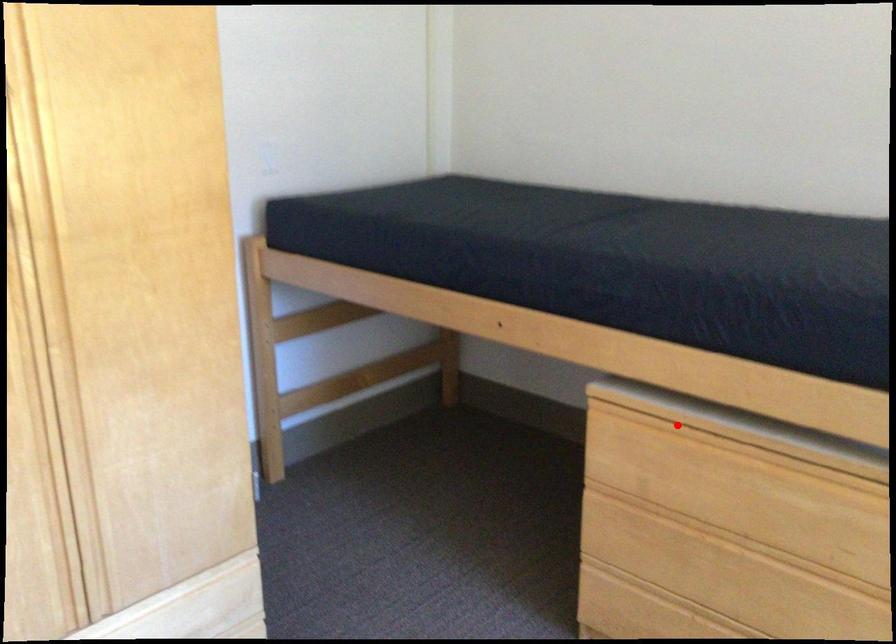
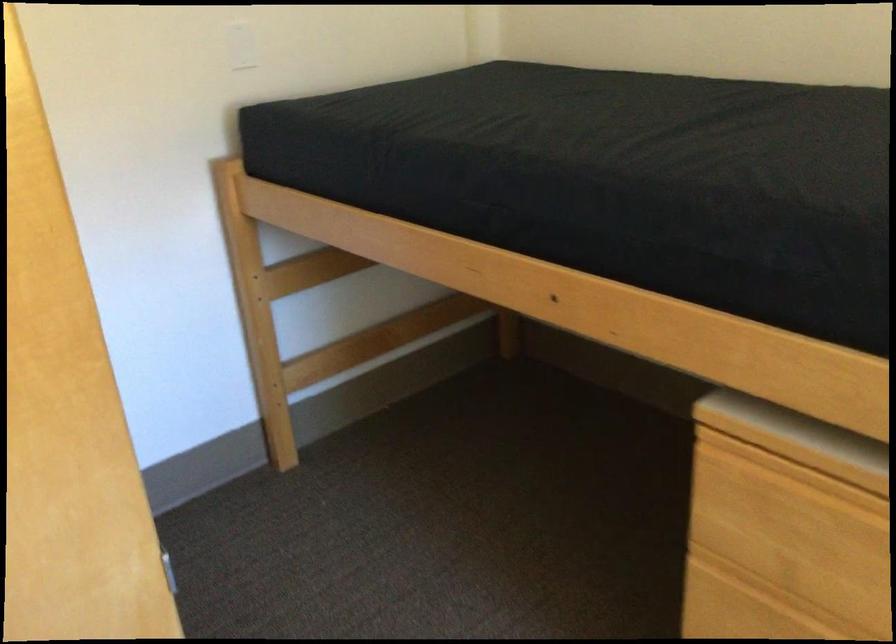
Find the pixel in the second image that matches the highlighted location in the first image.

(837, 474)